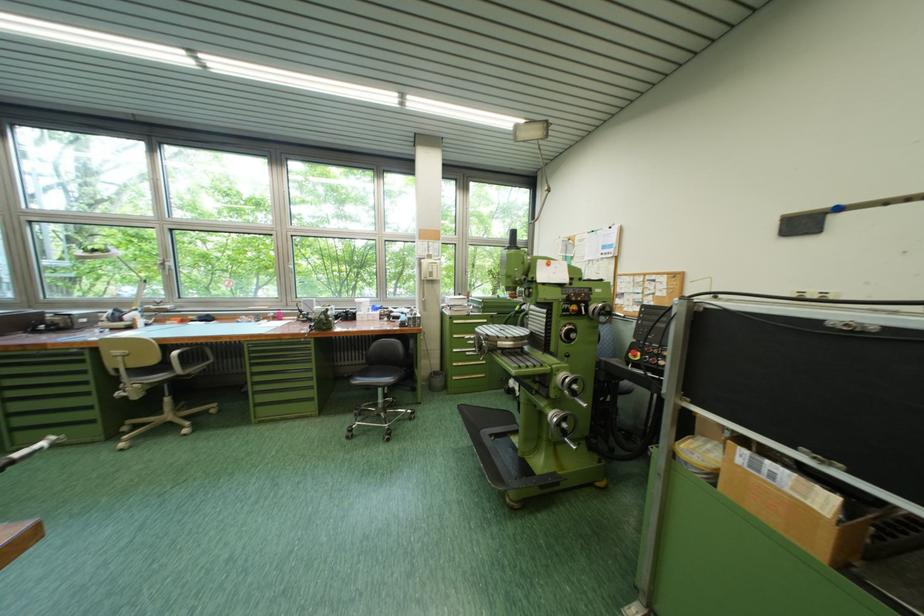
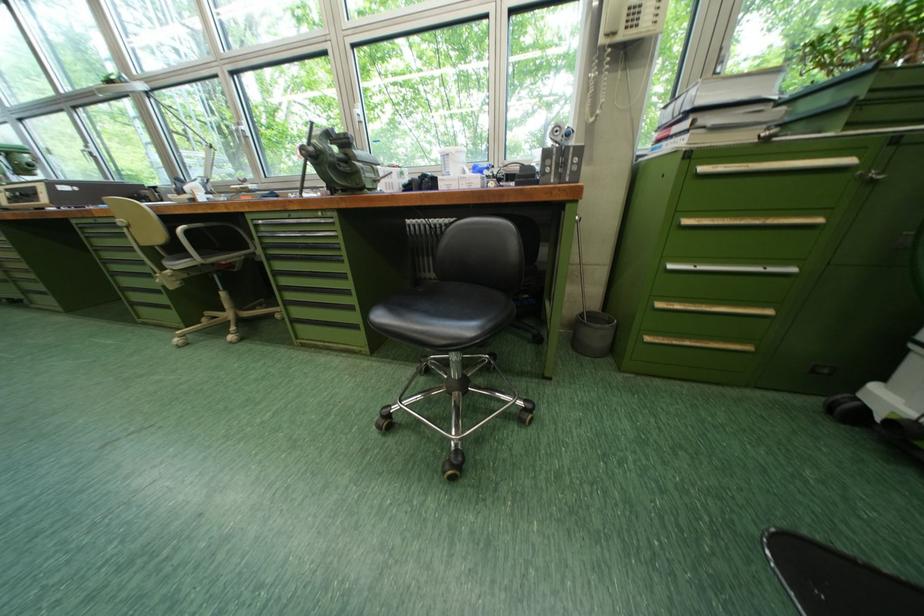
In the second image, find the point that corresponds to (465,381) in the first image.

(659, 341)